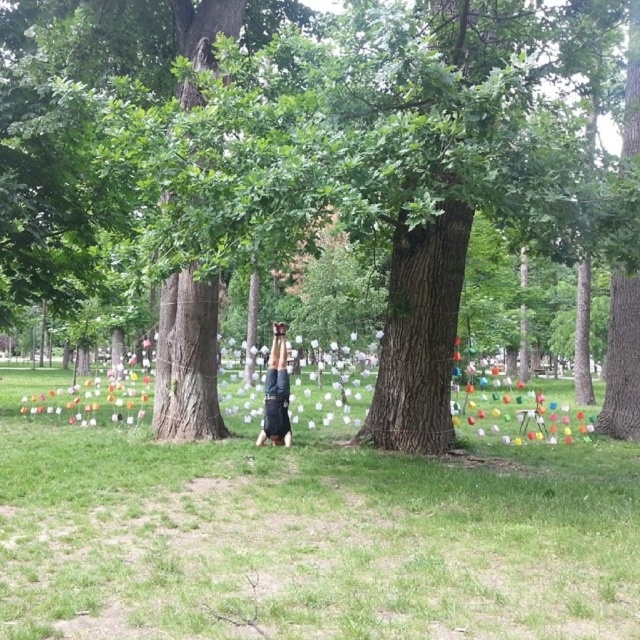
Question: Among these points, which one is farthest from the camera?

Choices:
 (A) (170, 252)
 (B) (273, 371)

Answer: (B)

Question: Is green rough bark tree at center wider than black fabric person at center?

Choices:
 (A) no
 (B) yes

Answer: (B)

Question: Is green rough bark tree at center closer to the viewer compared to green grass at center?

Choices:
 (A) yes
 (B) no

Answer: (B)

Question: Which point is farther to the camera?

Choices:
 (A) green rough bark tree at center
 (B) black fabric person at center

Answer: (B)

Question: Does green rough bark tree at center have a smaller size compared to black fabric person at center?

Choices:
 (A) no
 (B) yes

Answer: (A)

Question: Estimate the real-world distances between objects in this image. Which object is farther from the green grass at center?

Choices:
 (A) green rough bark tree at center
 (B) black fabric person at center

Answer: (B)